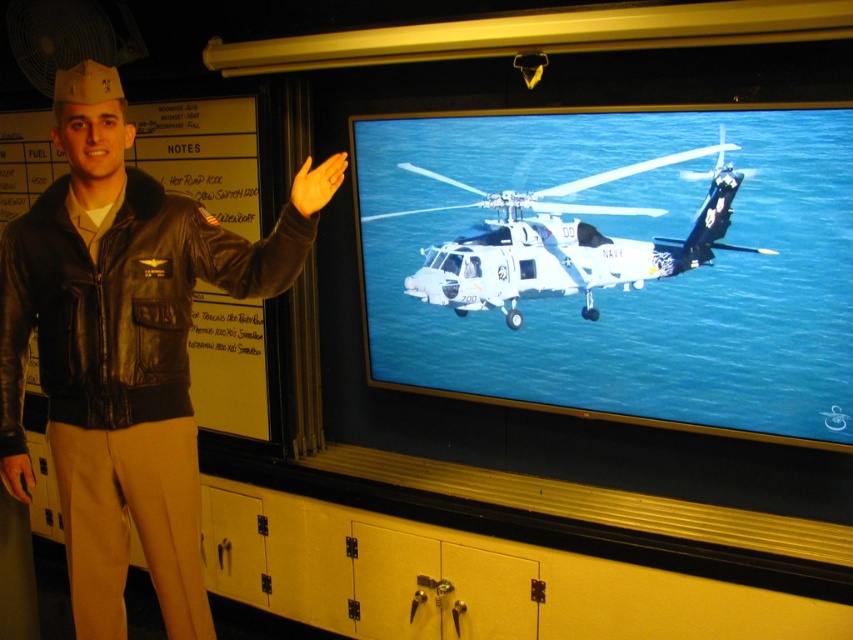
Can you confirm if white glossy helicopter at center is positioned to the right of metallic gray helicopter at center?

Yes, white glossy helicopter at center is to the right of metallic gray helicopter at center.

How far apart are white glossy helicopter at center and metallic gray helicopter at center?

A distance of 8.09 centimeters exists between white glossy helicopter at center and metallic gray helicopter at center.

Is point (846, 394) positioned before point (532, 228)?

Yes.

The image size is (853, 640). Find the location of `white glossy helicopter at center`. white glossy helicopter at center is located at coordinates (618, 262).

Does white glossy helicopter at center appear over black leather jacket at left?

Yes.

Who is positioned more to the left, white glossy helicopter at center or black leather jacket at left?

From the viewer's perspective, black leather jacket at left appears more on the left side.

Who is more distant from viewer, (463,348) or (144,516)?

The point (463,348) is more distant.

Image resolution: width=853 pixels, height=640 pixels. What are the coordinates of `white glossy helicopter at center` in the screenshot? It's located at (618, 262).

Does black leather jacket at left have a lesser width compared to metallic gray helicopter at center?

Yes.

Does black leather jacket at left have a larger size compared to metallic gray helicopter at center?

Yes.

At what (x,y) coordinates should I click in order to perform the action: click on black leather jacket at left. Please return your answer as a coordinate pair (x, y). Looking at the image, I should click on (125, 348).